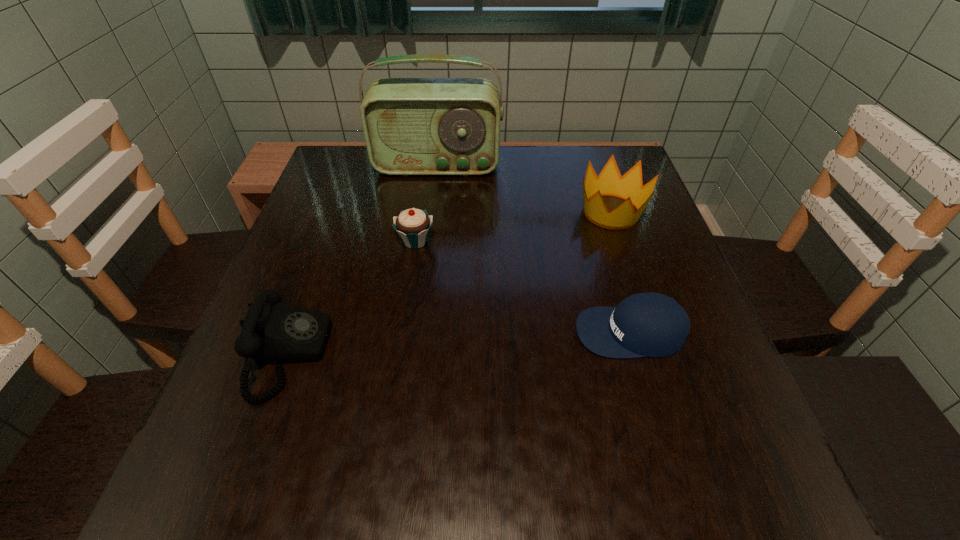
Find the location of a particular element. The height and width of the screenshot is (540, 960). vacant space that satisfies the following two spatial constraints: 1. on the front side of the crown; 2. on the dial of the telephone is located at coordinates (659, 355).